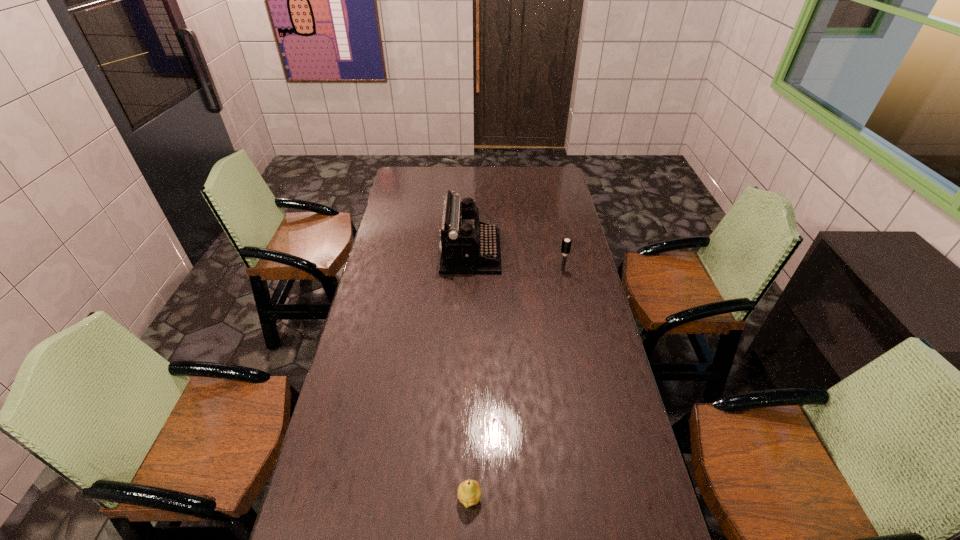
Find the location of a particular element. vacant area that satisfies the following two spatial constraints: 1. on the typing side of the hairbrush; 2. on the right side of the tallest object is located at coordinates (470, 271).

Where is `vacant space that satisfies the following two spatial constraints: 1. on the typing side of the tallest object; 2. on the right side of the nearest object`? Image resolution: width=960 pixels, height=540 pixels. vacant space that satisfies the following two spatial constraints: 1. on the typing side of the tallest object; 2. on the right side of the nearest object is located at coordinates (465, 498).

The width and height of the screenshot is (960, 540). Find the location of `free spot that satisfies the following two spatial constraints: 1. on the typing side of the pear; 2. on the left side of the tallest object`. free spot that satisfies the following two spatial constraints: 1. on the typing side of the pear; 2. on the left side of the tallest object is located at coordinates (465, 498).